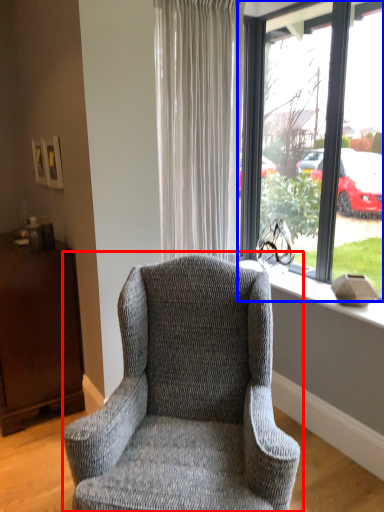
Question: Among these objects, which one is farthest to the camera, chair (highlighted by a red box) or window (highlighted by a blue box)?

Choices:
 (A) chair
 (B) window

Answer: (B)